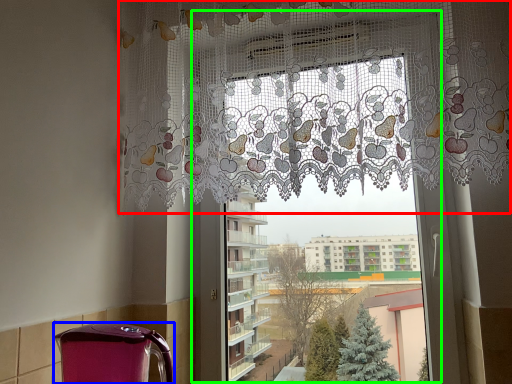
Question: Considering the real-world distances, which object is closest to curtain (highlighted by a red box)? appliance (highlighted by a blue box) or window frame (highlighted by a green box).

Choices:
 (A) appliance
 (B) window frame

Answer: (B)